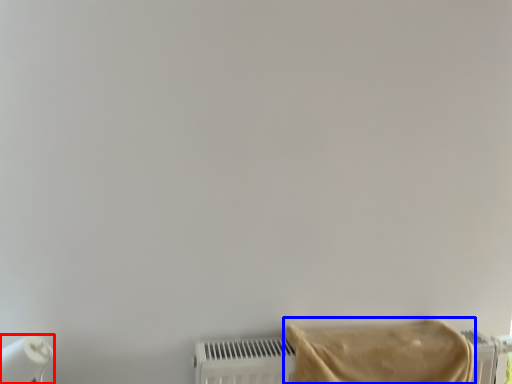
Question: Among these objects, which one is nearest to the camera, paper towel (highlighted by a red box) or towel (highlighted by a blue box)?

Choices:
 (A) paper towel
 (B) towel

Answer: (B)